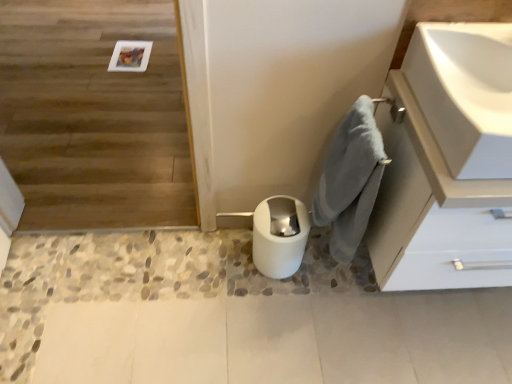
This screenshot has width=512, height=384. What are the coordinates of `free location to the left of white glossy toilet bowl at lower center` in the screenshot? It's located at (224, 264).